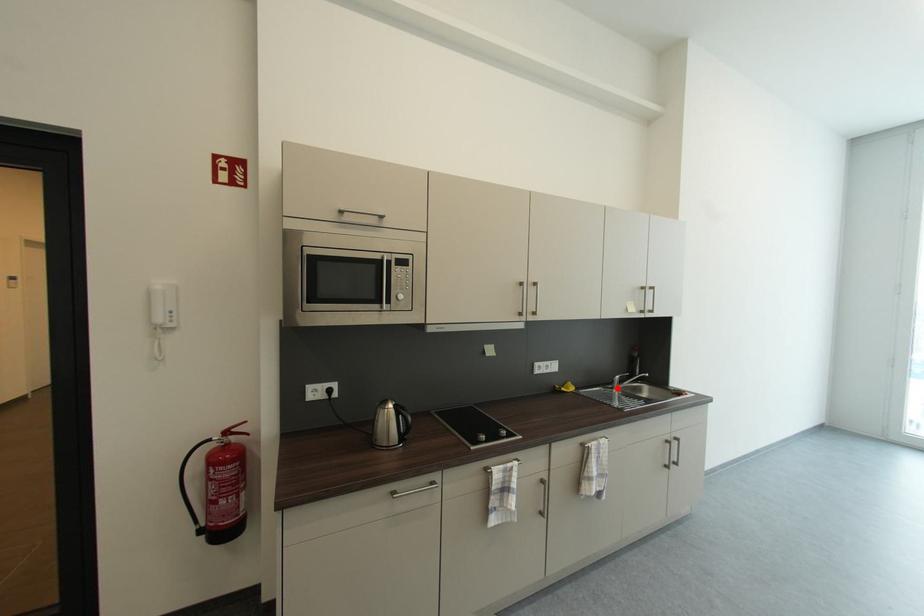
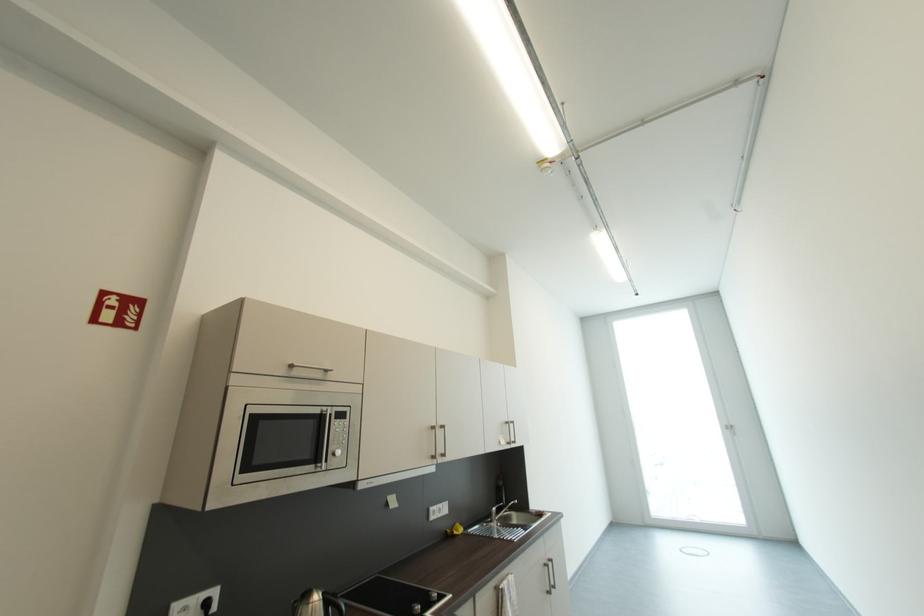
Question: I am providing you with two images of the same scene from different viewpoints. Image1 has a red point marked. In image2, the corresponding 3D location appears at what relative position? Reply with the corresponding letter.

Choices:
 (A) Closer
 (B) Farther

Answer: (B)